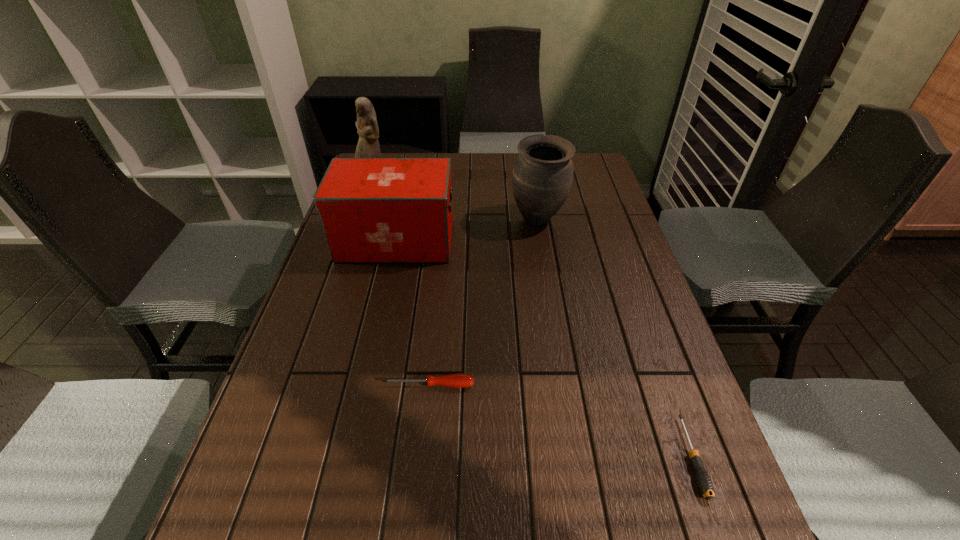
Find the location of `the farthest object`. the farthest object is located at coordinates (368, 146).

The height and width of the screenshot is (540, 960). Identify the location of the second object from right to left. (542, 177).

This screenshot has width=960, height=540. Find the location of `the first-aid kit`. the first-aid kit is located at coordinates (372, 210).

Find the location of a particular element. The image size is (960, 540). the farther screwdriver is located at coordinates (458, 380).

Locate an element on the screen. the left screwdriver is located at coordinates (458, 380).

The height and width of the screenshot is (540, 960). In order to click on the right screwdriver in this screenshot , I will do `click(705, 485)`.

You are a GUI agent. You are given a task and a screenshot of the screen. Output one action in this format:
    pyautogui.click(x=<x>, y=<y>)
    Task: Click on the nearer screwdriver
    
    Given the screenshot: What is the action you would take?
    pyautogui.click(x=705, y=485)

Image resolution: width=960 pixels, height=540 pixels. In order to click on vacant space situated on the front-facing side of the figurine in this screenshot , I will do `click(361, 213)`.

Where is `free spot located 0.200m on the left of the second object from right to left`? The height and width of the screenshot is (540, 960). free spot located 0.200m on the left of the second object from right to left is located at coordinates (446, 219).

Where is `vacant region located on the handle side of the first-aid kit`? vacant region located on the handle side of the first-aid kit is located at coordinates (528, 241).